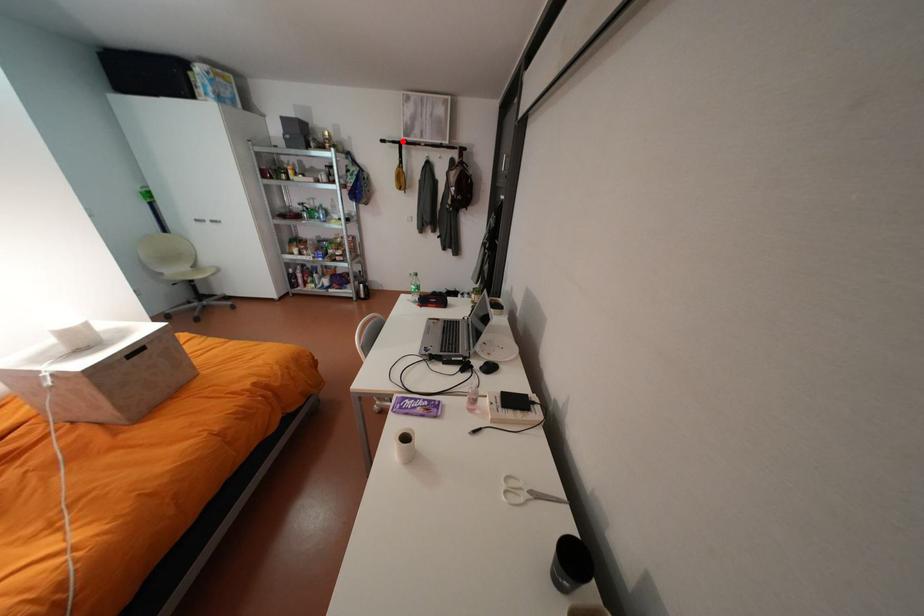
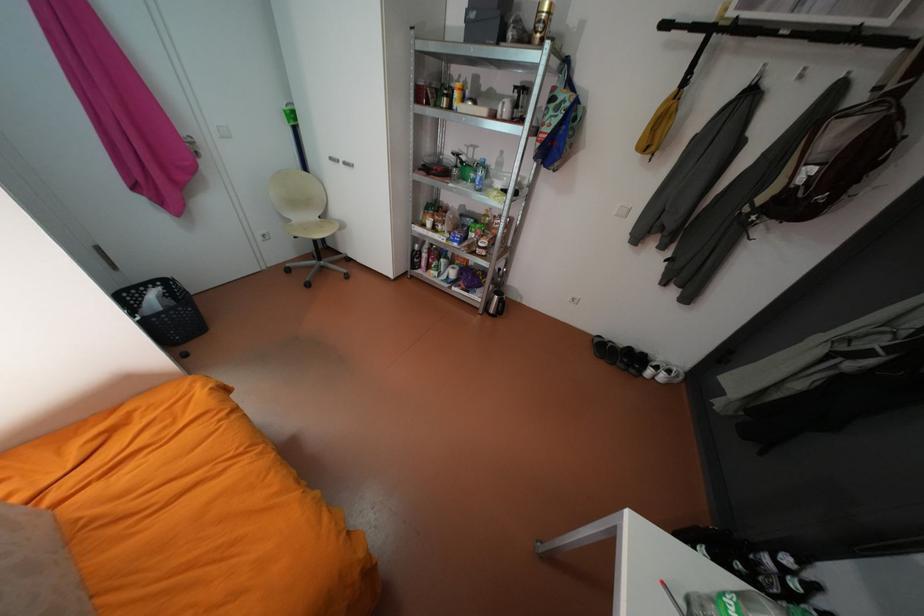
Question: I am providing you with two images of the same scene from different viewpoints. Given a red point in image1, look at the same physical point in image2. Is it:

Choices:
 (A) Closer to the viewpoint
 (B) Farther from the viewpoint

Answer: (B)